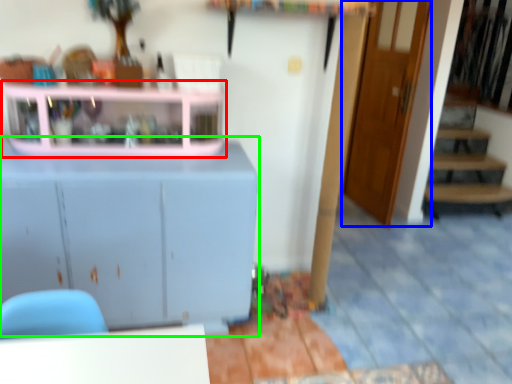
Question: Which object is the closest to the shelf (highlighted by a red box)? Choose among these: door (highlighted by a blue box) or cabinetry (highlighted by a green box).

Choices:
 (A) door
 (B) cabinetry

Answer: (B)